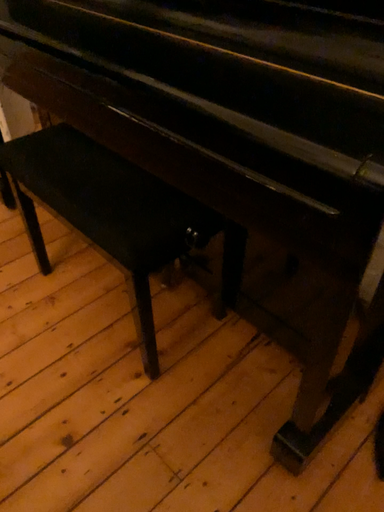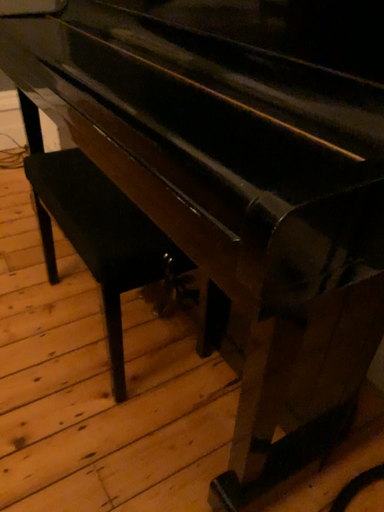
Question: How did the camera likely rotate when shooting the video?

Choices:
 (A) rotated downward
 (B) rotated upward

Answer: (B)